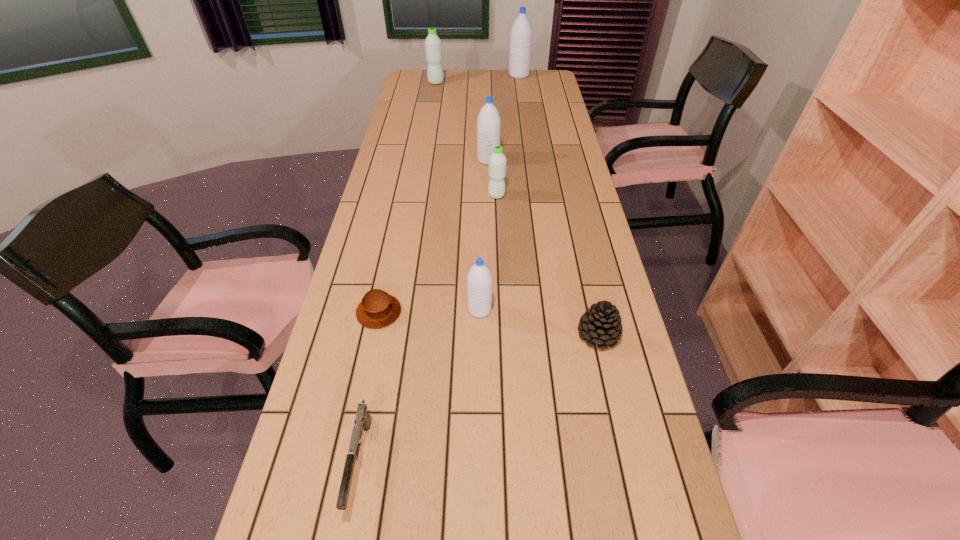
Where is `unoccupied area between the left green water bottle and the biggest blue water bottle`? unoccupied area between the left green water bottle and the biggest blue water bottle is located at coordinates (477, 79).

This screenshot has height=540, width=960. I want to click on empty location between the gray gun and the pinecone, so click(479, 399).

The image size is (960, 540). Identify the location of vacant area between the sixth tallest object and the rightmost water bottle. (559, 205).

Where is `free area in between the shortest object and the third farthest object`? Image resolution: width=960 pixels, height=540 pixels. free area in between the shortest object and the third farthest object is located at coordinates (434, 236).

Locate which object ranks seventh in proximity to the muffin. Please provide its 2D coordinates. Your answer should be formatted as a tuple, i.e. [(x, y)], where the tuple contains the x and y coordinates of a point satisfying the conditions above.

[(521, 32)]

Locate which object ranks sixth in proximity to the sixth tallest object. Please provide its 2D coordinates. Your answer should be formatted as a tuple, i.e. [(x, y)], where the tuple contains the x and y coordinates of a point satisfying the conditions above.

[(433, 48)]

Identify which water bottle is the nearest to the rightmost water bottle. Please provide its 2D coordinates. Your answer should be formatted as a tuple, i.e. [(x, y)], where the tuple contains the x and y coordinates of a point satisfying the conditions above.

[(433, 48)]

Identify the location of the fifth closest water bottle to the third shortest object. The image size is (960, 540). (521, 32).

Locate which blue water bottle is the closest to the nearest water bottle. Please provide its 2D coordinates. Your answer should be formatted as a tuple, i.e. [(x, y)], where the tuple contains the x and y coordinates of a point satisfying the conditions above.

[(488, 123)]

Point out which blue water bottle is positioned as the third nearest to the fourth farthest object. Please provide its 2D coordinates. Your answer should be formatted as a tuple, i.e. [(x, y)], where the tuple contains the x and y coordinates of a point satisfying the conditions above.

[(521, 32)]